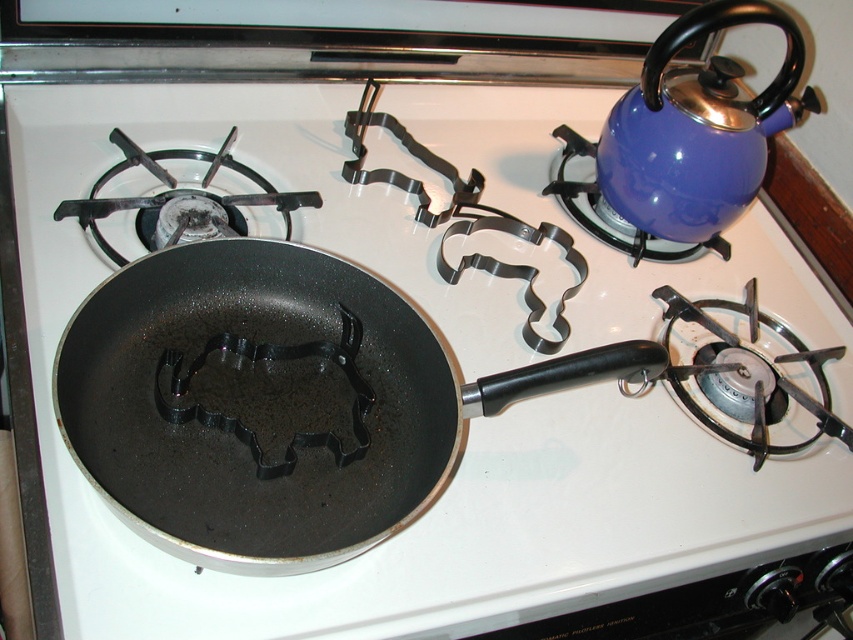
Between non-stick black frying pan at center and blue enamel kettle at upper right, which one is positioned lower?

non-stick black frying pan at center is below.

Can you confirm if non-stick black frying pan at center is taller than blue enamel kettle at upper right?

Incorrect, non-stick black frying pan at center's height is not larger of blue enamel kettle at upper right's.

Between point (152, 531) and point (625, 116), which one is positioned in front?

Point (152, 531)

Locate an element on the screen. This screenshot has height=640, width=853. non-stick black frying pan at center is located at coordinates (276, 403).